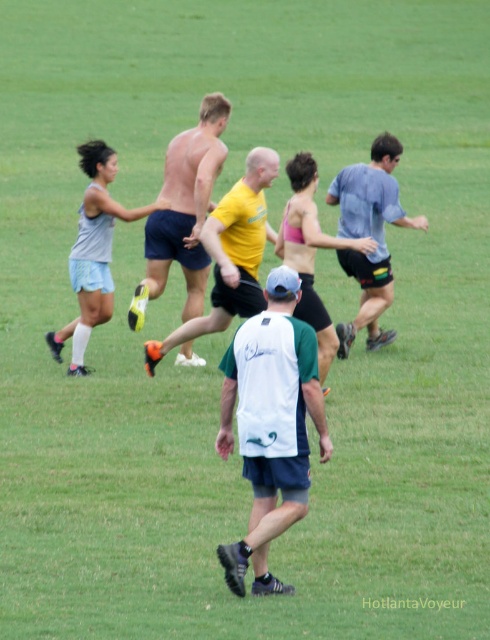
Does white/green fabric shirt at center lie behind shiny blue shorts at center?

No, it is not.

Does point (290, 488) lie behind point (226, 108)?

That is False.

At what (x,y) coordinates should I click in order to perform the action: click on white/green fabric shirt at center. Please return your answer as a coordinate pair (x, y). Looking at the image, I should click on (270, 426).

Based on the photo, can you confirm if shiny blue shorts at center is bigger than yellow matte shirt at center?

Correct, shiny blue shorts at center is larger in size than yellow matte shirt at center.

This screenshot has width=490, height=640. What do you see at coordinates (184, 211) in the screenshot?
I see `shiny blue shorts at center` at bounding box center [184, 211].

Where is `shiny blue shorts at center`? The width and height of the screenshot is (490, 640). shiny blue shorts at center is located at coordinates (184, 211).

Which is more to the left, yellow matte shirt at center or light blue fabric shirt at right?

yellow matte shirt at center is more to the left.

Does yellow matte shirt at center have a lesser width compared to light blue fabric shirt at right?

Yes.

Identify the location of yellow matte shirt at center. (230, 253).